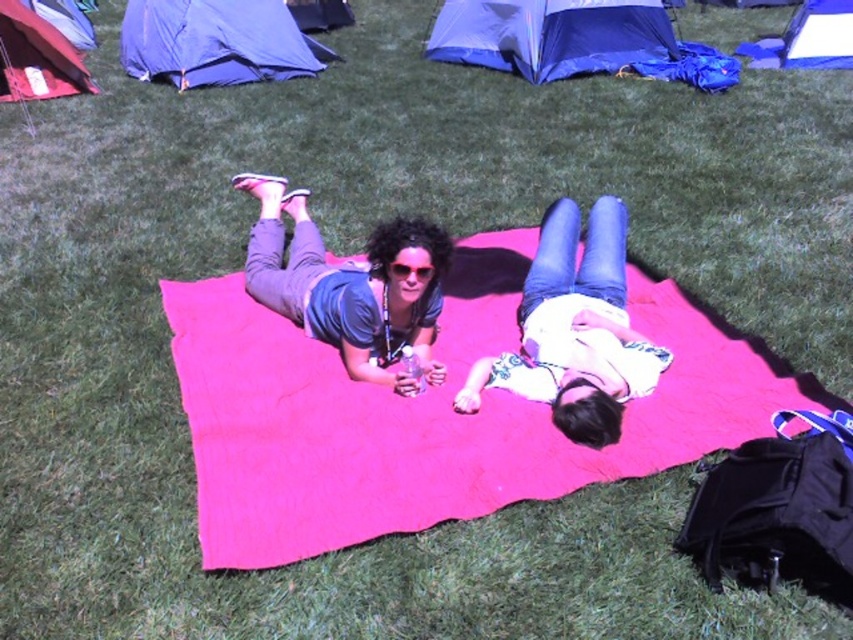
You are standing at the origin point of the coordinate system, which is the bottom left corner of the image. You see a point labeled at coordinates point (807, 38). What object is located at that point?

The blue fabric tent at upper right is located at point (807, 38).

You are planning to take a photo of the matte gray shirt at center. To ensure it is in the frame, where should you position your camera relative to the scene?

The matte gray shirt at center is located at point coordinates of 0.445 on the x axis and 0.410 on the y axis, so position the camera so that the center of the frame aligns with those coordinates to capture the matte gray shirt at center.

You are standing at the point marked as point (349, 284) in the image. Looking around, you see a bright pink blanket with two people lying on it. The person on the left has curly dark hair and is holding a water bottle. The person on the right has a white top and dark blue jeans. Behind them are several tents of different colors. What is directly beneath your feet at this point?

The point (349, 284) is on matte gray shirt at center, so the direct location beneath your feet is the matte gray shirt at center.